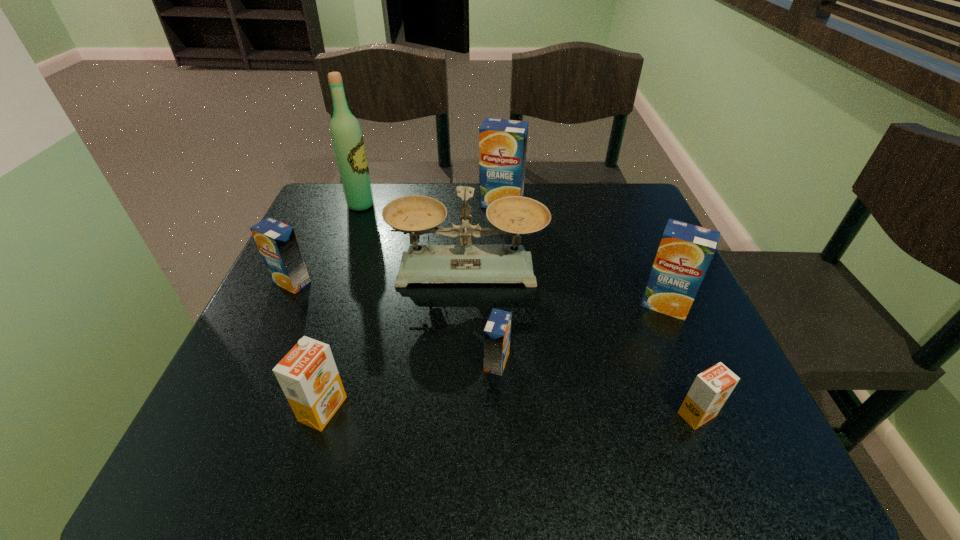
In the image, there is a desktop. At what (x,y) coordinates should I click in order to perform the action: click on vacant space at the left edge. Please return your answer as a coordinate pair (x, y). This screenshot has height=540, width=960. Looking at the image, I should click on (226, 389).

Find the location of `vacant space at the right edge`. vacant space at the right edge is located at coordinates (626, 249).

This screenshot has width=960, height=540. I want to click on vacant space at the far right corner, so click(631, 215).

In the image, there is a desktop. At what (x,y) coordinates should I click in order to perform the action: click on free space at the near right corner. Please return your answer as a coordinate pair (x, y). The image size is (960, 540). Looking at the image, I should click on point(680,463).

You are a GUI agent. You are given a task and a screenshot of the screen. Output one action in this format:
    pyautogui.click(x=<x>, y=<y>)
    Task: Click on the vacant area between the leftmost object and the tallest orange juice
    
    Given the screenshot: What is the action you would take?
    pyautogui.click(x=396, y=242)

I want to click on free space between the fourth farthest orange juice and the rightmost blue orange_juice, so click(581, 333).

Where is `blank region between the second biggest blue orange_juice and the tallest orange juice`? Image resolution: width=960 pixels, height=540 pixels. blank region between the second biggest blue orange_juice and the tallest orange juice is located at coordinates (583, 254).

Where is `free space between the fourth farthest orange juice and the bigger orange orange juice`? free space between the fourth farthest orange juice and the bigger orange orange juice is located at coordinates (410, 386).

Find the location of a particular element. Image resolution: width=960 pixels, height=540 pixels. free space between the bigger orange orange juice and the scale is located at coordinates (396, 340).

Identify the location of vacant region between the white wine bottle and the left orange orange juice. (342, 307).